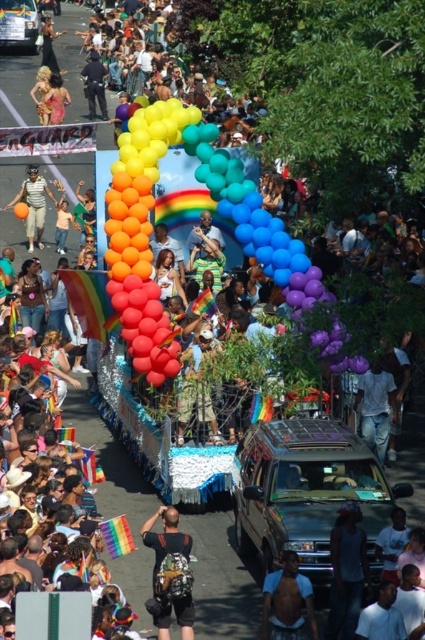
Is shiny metallic shorts at lower center thinner than black leather jacket at upper left?

Yes.

Does point (261, 611) come behind point (53, 64)?

No.

Where is `shiny metallic shorts at lower center`? This screenshot has width=425, height=640. shiny metallic shorts at lower center is located at coordinates (286, 602).

Which is more to the left, light brown hair at lower center or orange matte balloon at center?

From the viewer's perspective, orange matte balloon at center appears more on the left side.

Between point (396, 570) and point (19, 205), which one is positioned behind?

Point (19, 205)

Locate an element on the screen. light brown hair at lower center is located at coordinates (391, 544).

Does dark blue uniform at center have a lesser width compared to orange matte balloon at center?

In fact, dark blue uniform at center might be wider than orange matte balloon at center.

Consider the image. Measure the distance between point (88,67) and camera.

Point (88,67) is 83.21 meters away from camera.

What are the coordinates of `dark blue uniform at center` in the screenshot? It's located at (95, 84).